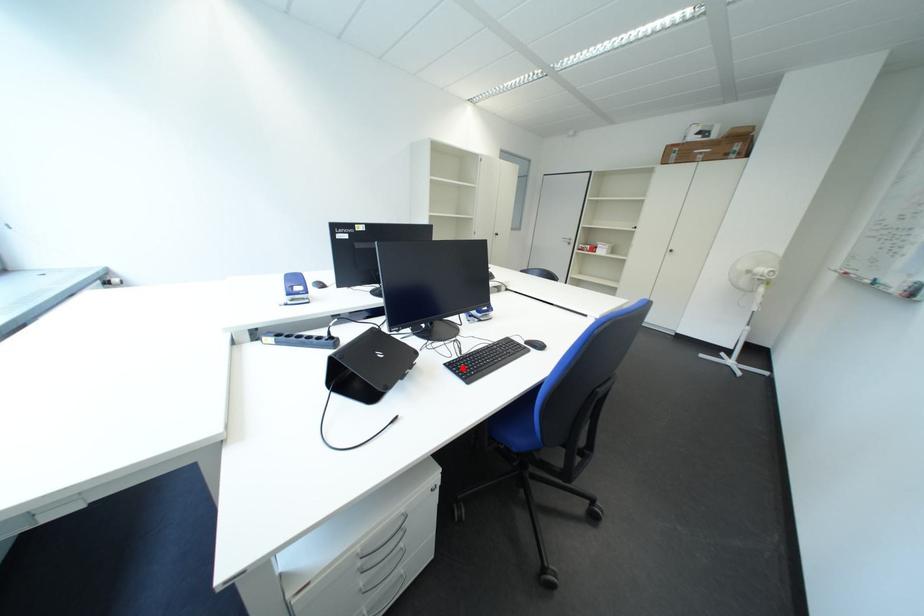
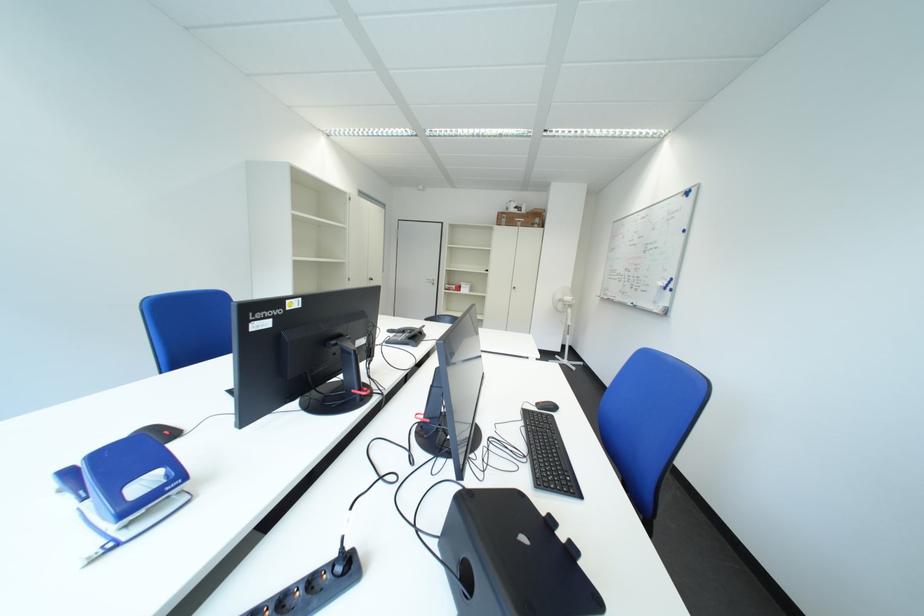
Locate, in the second image, the point that corresponds to the highlighted location in the first image.

(553, 485)